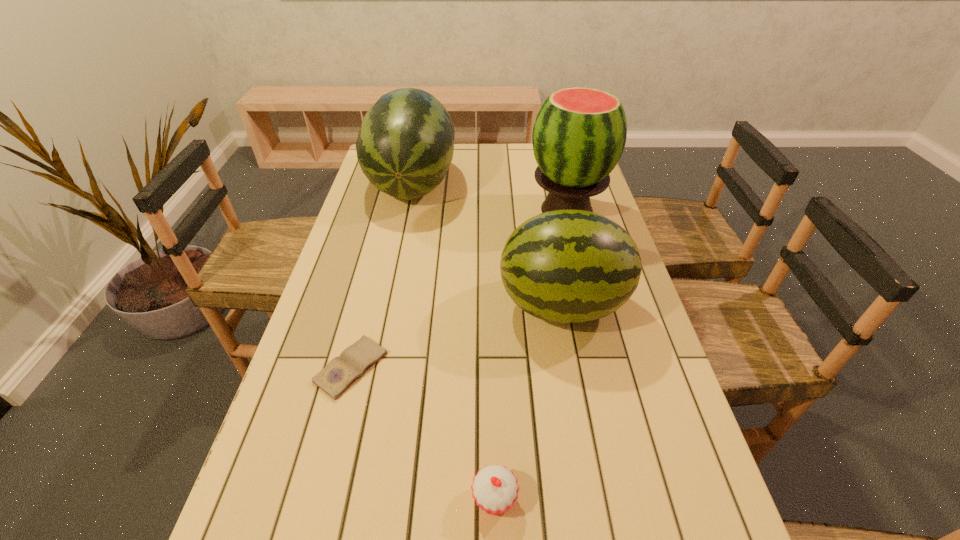
At what (x,y) coordinates should I click in order to perform the action: click on the second tallest watermelon. Please return your answer as a coordinate pair (x, y). Looking at the image, I should click on (405, 145).

Where is `the leftmost watermelon`? the leftmost watermelon is located at coordinates (405, 145).

Identify the location of the shortest watermelon. The image size is (960, 540). (564, 266).

This screenshot has width=960, height=540. I want to click on the nearest watermelon, so click(564, 266).

Where is `cupcake`? cupcake is located at coordinates (495, 489).

Locate an element on the screen. the nearest object is located at coordinates (495, 489).

Find the location of `the shortest object`. the shortest object is located at coordinates (341, 372).

Locate an element on the screen. vacant space located on the front of the second tallest object is located at coordinates (391, 282).

Image resolution: width=960 pixels, height=540 pixels. I want to click on free space located at the stem end of the shortest watermelon, so point(444,305).

Locate an element on the screen. The width and height of the screenshot is (960, 540). free space located at the stem end of the shortest watermelon is located at coordinates (416, 305).